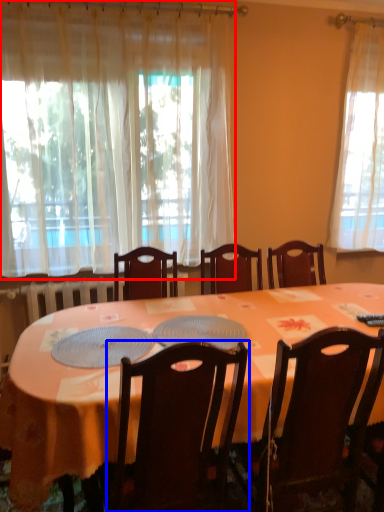
Question: Which of the following is the farthest to the observer, curtain (highlighted by a red box) or chair (highlighted by a blue box)?

Choices:
 (A) curtain
 (B) chair

Answer: (A)